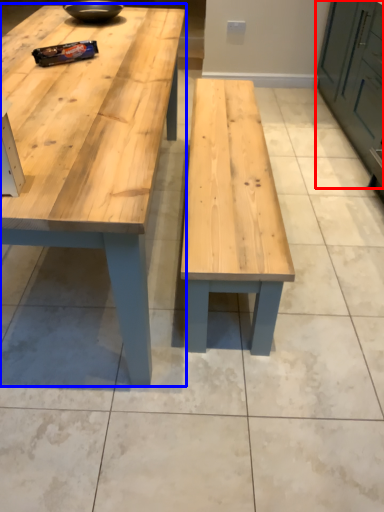
Question: Which object appears closest to the camera in this image, cabinetry (highlighted by a red box) or table (highlighted by a blue box)?

Choices:
 (A) cabinetry
 (B) table

Answer: (B)